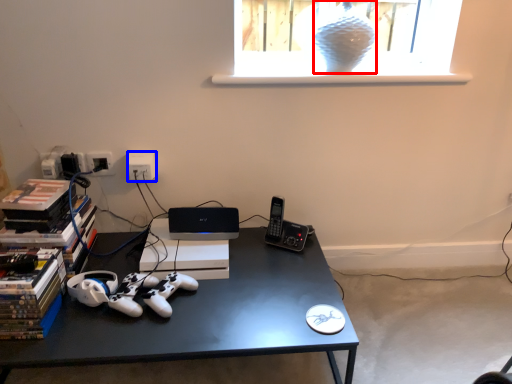
Question: Which object is closer to the camera taking this photo, glass vase (highlighted by a red box) or electric outlet (highlighted by a blue box)?

Choices:
 (A) glass vase
 (B) electric outlet

Answer: (A)